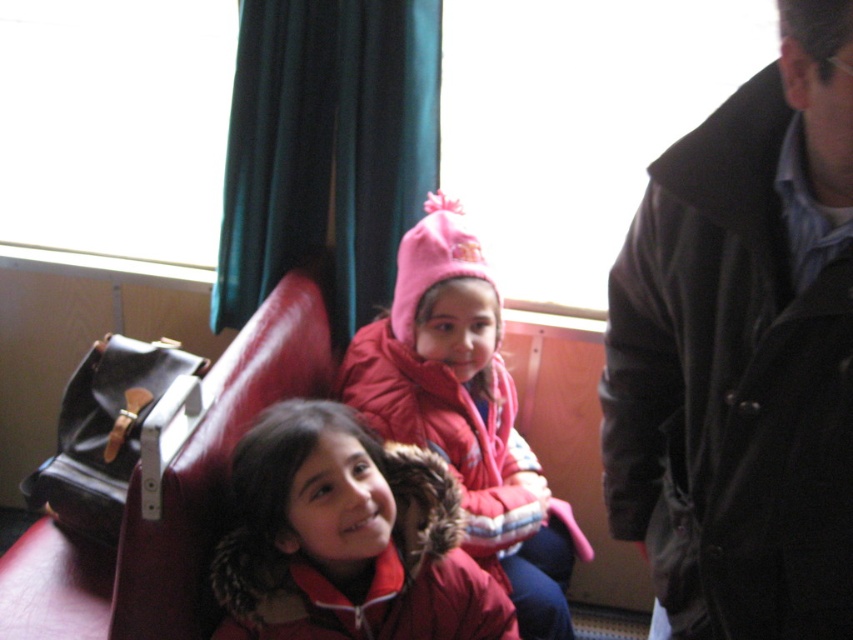
Question: Does black leather jacket at upper right appear over red fleece jacket at center?

Choices:
 (A) no
 (B) yes

Answer: (B)

Question: Is the position of black leather jacket at upper right more distant than that of fuzzy red jacket at center?

Choices:
 (A) no
 (B) yes

Answer: (A)

Question: Which object is closer to the camera taking this photo?

Choices:
 (A) fuzzy red jacket at center
 (B) red fleece jacket at center
 (C) black leather jacket at upper right
 (D) pink fleece hat at center

Answer: (C)

Question: Which point is closer to the camera?

Choices:
 (A) (436, 301)
 (B) (297, 586)
 (C) (699, 305)
 (D) (532, 461)

Answer: (C)

Question: Can you confirm if fuzzy red jacket at center is positioned below pink fleece hat at center?

Choices:
 (A) no
 (B) yes

Answer: (B)

Question: Considering the real-world distances, which object is closest to the fuzzy red jacket at center?

Choices:
 (A) pink fleece hat at center
 (B) red fleece jacket at center
 (C) black leather jacket at upper right

Answer: (B)